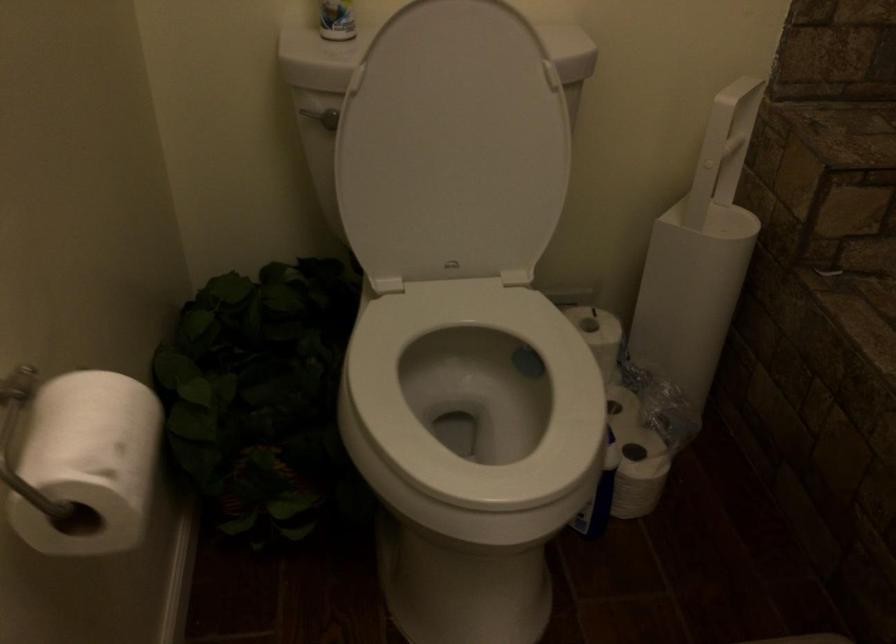
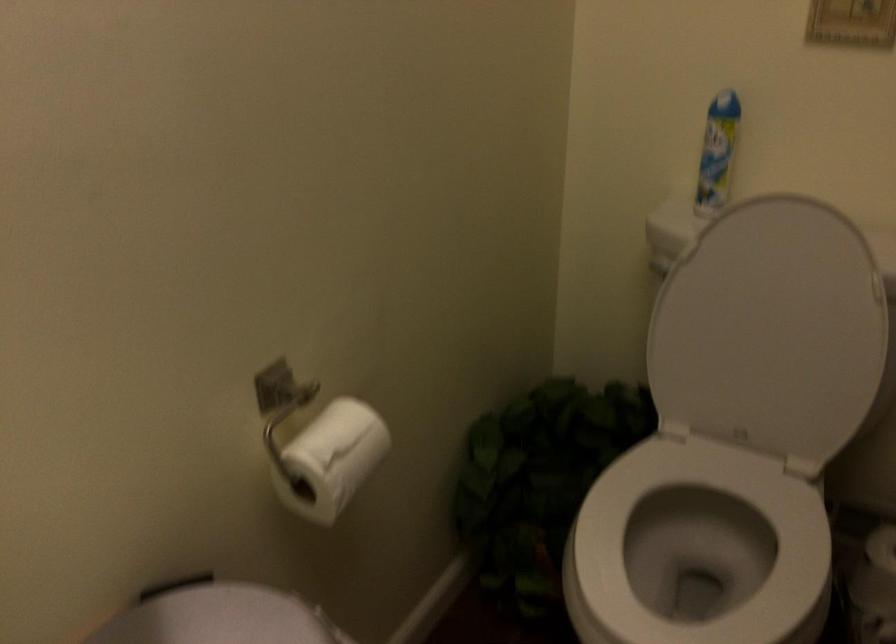
Locate, in the second image, the point that corresponds to (460,147) in the first image.

(771, 330)